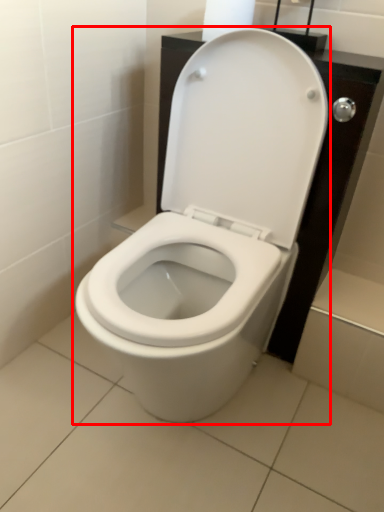
Question: From the image's perspective, where is toilet (annotated by the red box) located in relation to toilet paper in the image?

Choices:
 (A) below
 (B) above

Answer: (A)